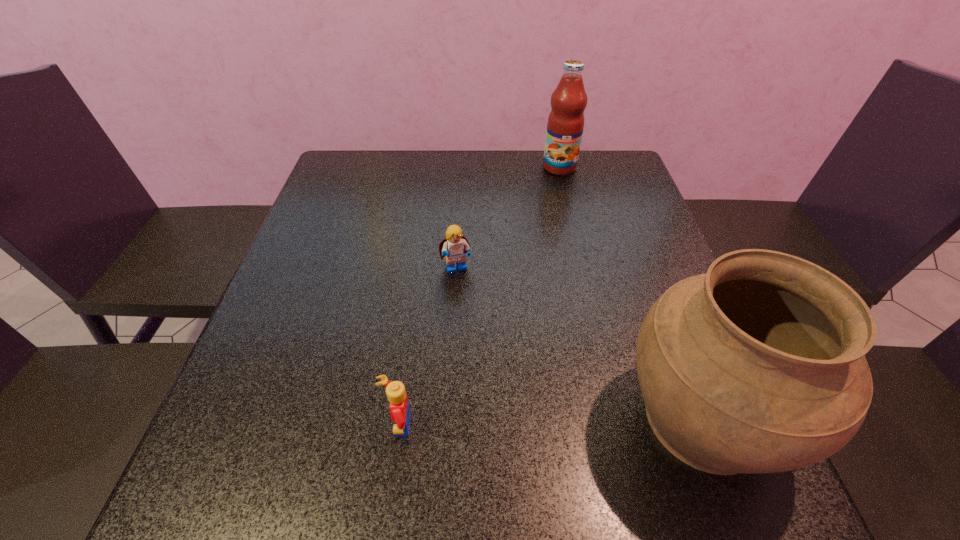
Identify which object is the nearest to the urn. Please provide its 2D coordinates. Your answer should be formatted as a tuple, i.e. [(x, y)], where the tuple contains the x and y coordinates of a point satisfying the conditions above.

[(455, 246)]

The width and height of the screenshot is (960, 540). Identify the location of object that is the closest one to the urn. (455, 246).